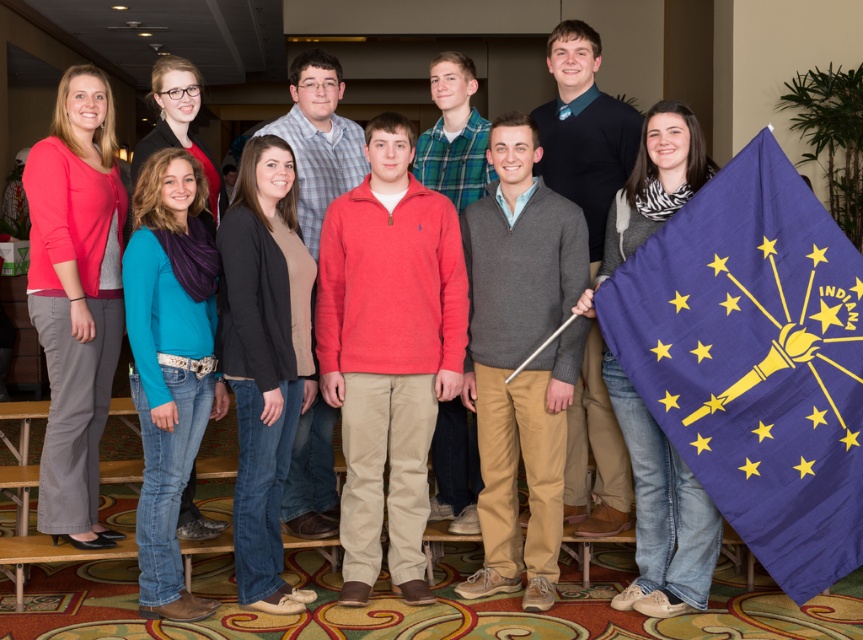
Question: Does black cardigan at center come in front of teal sweater at center?

Choices:
 (A) yes
 (B) no

Answer: (B)

Question: Considering the real-world distances, which object is closest to the black cardigan at center?

Choices:
 (A) matte pink sweater at center
 (B) zebra print scarf at center
 (C) teal sweater at center
 (D) blue fabric flag at lower right

Answer: (C)

Question: Can you confirm if matte pink sweater at center is positioned above zebra print scarf at center?

Choices:
 (A) no
 (B) yes

Answer: (B)

Question: Which object is closer to the camera taking this photo?

Choices:
 (A) black cardigan at center
 (B) blue fabric flag at lower right
 (C) zebra print scarf at center

Answer: (B)

Question: Observing the image, what is the correct spatial positioning of teal sweater at center in reference to zebra print scarf at center?

Choices:
 (A) below
 (B) above

Answer: (B)

Question: Which point is farther to the camera?

Choices:
 (A) (754, 236)
 (B) (659, 200)
 (C) (162, 362)

Answer: (B)